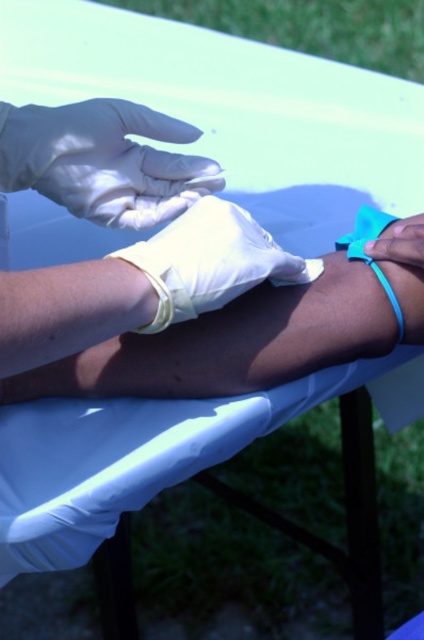
Question: Estimate the real-world distances between objects in this image. Which object is closer to the blue rubber band at lower right?

Choices:
 (A) white latex glove at center
 (B) white matte glove at center
 (C) white latex glove at upper center

Answer: (A)

Question: Can you confirm if white matte glove at center is positioned below blue rubber band at lower right?

Choices:
 (A) yes
 (B) no

Answer: (A)

Question: Which point appears closest to the camera in this image?

Choices:
 (A) (150, 115)
 (B) (381, 257)

Answer: (A)

Question: Which point appears closest to the camera in this image?

Choices:
 (A) (100, 296)
 (B) (22, 134)

Answer: (A)

Question: Is white matte glove at center to the left of white latex glove at center from the viewer's perspective?

Choices:
 (A) yes
 (B) no

Answer: (A)

Question: Does white latex glove at center have a lesser width compared to blue rubber band at lower right?

Choices:
 (A) no
 (B) yes

Answer: (A)